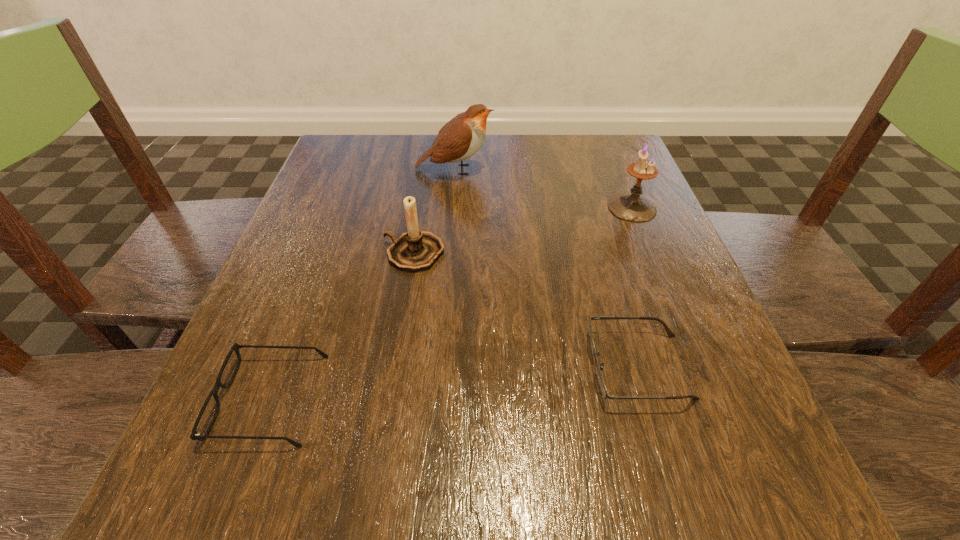
At what (x,y) coordinates should I click in order to perform the action: click on vacant space at the left edge of the desktop. Please return your answer as a coordinate pair (x, y). Image resolution: width=960 pixels, height=540 pixels. Looking at the image, I should click on (298, 356).

Locate an element on the screen. This screenshot has width=960, height=540. vacant region at the right edge of the desktop is located at coordinates click(590, 200).

In the image, there is a desktop. Identify the location of vacant space at the far left corner. Image resolution: width=960 pixels, height=540 pixels. (381, 163).

In the image, there is a desktop. What are the coordinates of `free space at the near left corner` in the screenshot? It's located at (291, 496).

Where is `vacant space at the far right corner`? vacant space at the far right corner is located at coordinates (599, 163).

Where is `vacant space at the near right corner of the desktop`? Image resolution: width=960 pixels, height=540 pixels. vacant space at the near right corner of the desktop is located at coordinates (747, 460).

Locate an element on the screen. The height and width of the screenshot is (540, 960). free space between the right spectacles and the farthest object is located at coordinates (546, 268).

What are the coordinates of `free space between the second farthest object and the leftmost object` in the screenshot? It's located at (450, 303).

In order to click on vacant space that is in between the left spectacles and the farthest object in this screenshot , I will do `click(362, 284)`.

The image size is (960, 540). I want to click on vacant area that lies between the nearer candle holder and the right candle holder, so click(523, 231).